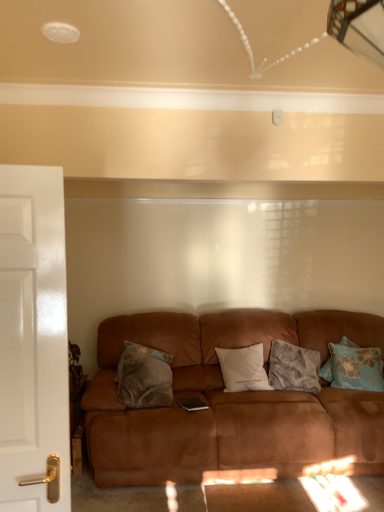
Question: From a real-world perspective, is white soft cushion at center, the 3th pillow viewed from the right, positioned over fluffy gray pillow at center, the third pillow positioned from the left, based on gravity?

Choices:
 (A) no
 (B) yes

Answer: (B)

Question: Is white soft cushion at center, the 3th pillow viewed from the right, next to fluffy gray pillow at center, the third pillow positioned from the left?

Choices:
 (A) no
 (B) yes

Answer: (A)

Question: Considering the relative positions of white soft cushion at center, acting as the 2th pillow starting from the left, and fluffy gray pillow at center, the second pillow from the right, in the image provided, is white soft cushion at center, acting as the 2th pillow starting from the left, to the left of fluffy gray pillow at center, the second pillow from the right, from the viewer's perspective?

Choices:
 (A) no
 (B) yes

Answer: (B)

Question: Is white soft cushion at center, acting as the 2th pillow starting from the left, wider than fluffy gray pillow at center, the second pillow from the right?

Choices:
 (A) no
 (B) yes

Answer: (B)

Question: Can you confirm if white soft cushion at center, the 3th pillow viewed from the right, is smaller than fluffy gray pillow at center, the second pillow from the right?

Choices:
 (A) no
 (B) yes

Answer: (A)

Question: Is fluffy brown pillow at center, the fourth pillow in the right-to-left sequence, inside or outside of white glossy door at left?

Choices:
 (A) outside
 (B) inside

Answer: (A)

Question: Is point (129, 344) positioned closer to the camera than point (6, 295)?

Choices:
 (A) closer
 (B) farther

Answer: (B)

Question: From the image's perspective, is fluffy brown pillow at center, the fourth pillow in the right-to-left sequence, positioned above or below white glossy door at left?

Choices:
 (A) above
 (B) below

Answer: (B)

Question: Based on their positions, is fluffy brown pillow at center, which is counted as the first pillow, starting from the left, located to the left or right of white glossy door at left?

Choices:
 (A) left
 (B) right

Answer: (B)

Question: Does point (319, 355) appear closer or farther from the camera than point (359, 379)?

Choices:
 (A) closer
 (B) farther

Answer: (B)

Question: Is fluffy gray pillow at center, the third pillow positioned from the left, bigger or smaller than blue floral pillow at right, the 4th pillow positioned from the left?

Choices:
 (A) big
 (B) small

Answer: (A)

Question: Which is correct: fluffy gray pillow at center, the second pillow from the right, is inside blue floral pillow at right, the 1th pillow when ordered from right to left, or outside of it?

Choices:
 (A) outside
 (B) inside

Answer: (A)

Question: From the image's perspective, is fluffy gray pillow at center, the second pillow from the right, located above or below blue floral pillow at right, the 1th pillow when ordered from right to left?

Choices:
 (A) below
 (B) above

Answer: (A)

Question: Which is correct: white glossy door at left is inside fluffy gray pillow at center, the third pillow positioned from the left, or outside of it?

Choices:
 (A) inside
 (B) outside

Answer: (B)

Question: From a real-world perspective, is white glossy door at left above or below fluffy gray pillow at center, the second pillow from the right?

Choices:
 (A) above
 (B) below

Answer: (A)